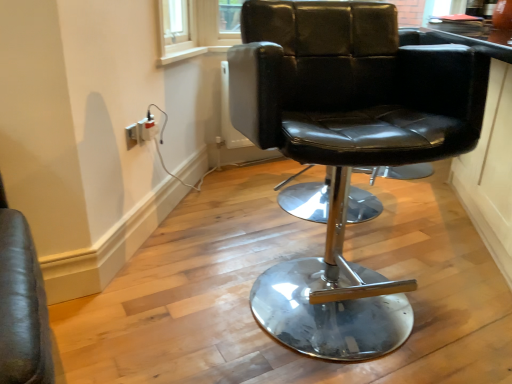
Question: Can you confirm if white plastic electric outlet at lower left, the first electric outlet viewed from the left, is bigger than black leather chair at center?

Choices:
 (A) no
 (B) yes

Answer: (A)

Question: From the image's perspective, is white plastic electric outlet at lower left, the 2th electric outlet viewed from the back, below black leather chair at center?

Choices:
 (A) no
 (B) yes

Answer: (A)

Question: Is white plastic electric outlet at lower left, the 2th electric outlet viewed from the back, positioned before black leather chair at center?

Choices:
 (A) yes
 (B) no

Answer: (B)

Question: Is white plastic electric outlet at lower left, the first electric outlet viewed from the left, facing towards black leather chair at center?

Choices:
 (A) yes
 (B) no

Answer: (A)

Question: Considering the relative sizes of white plastic electric outlet at lower left, the 2th electric outlet viewed from the back, and black leather chair at center in the image provided, is white plastic electric outlet at lower left, the 2th electric outlet viewed from the back, smaller than black leather chair at center?

Choices:
 (A) no
 (B) yes

Answer: (B)

Question: Can you confirm if white plastic electric outlet at lower left, the 2th electric outlet viewed from the back, is thinner than black leather chair at center?

Choices:
 (A) no
 (B) yes

Answer: (B)

Question: Can we say white plastic electric outlet at lower left, the first electric outlet viewed from the left, lies outside white plastic socket at lower left, the 1th electric outlet from the back?

Choices:
 (A) no
 (B) yes

Answer: (B)

Question: From a real-world perspective, is white plastic electric outlet at lower left, the 1th electric outlet from the front, under white plastic socket at lower left, acting as the 2th electric outlet starting from the front?

Choices:
 (A) no
 (B) yes

Answer: (B)

Question: Are white plastic electric outlet at lower left, the 1th electric outlet from the front, and white plastic socket at lower left, the 1th electric outlet in the right-to-left sequence, located far from each other?

Choices:
 (A) no
 (B) yes

Answer: (A)

Question: Considering the relative positions of white plastic electric outlet at lower left, the 1th electric outlet from the front, and white plastic socket at lower left, the 1th electric outlet in the right-to-left sequence, in the image provided, is white plastic electric outlet at lower left, the 1th electric outlet from the front, to the right of white plastic socket at lower left, the 1th electric outlet in the right-to-left sequence, from the viewer's perspective?

Choices:
 (A) no
 (B) yes

Answer: (A)

Question: Considering the relative sizes of white plastic electric outlet at lower left, placed as the 2th electric outlet when sorted from right to left, and white plastic socket at lower left, positioned as the second electric outlet in left-to-right order, in the image provided, is white plastic electric outlet at lower left, placed as the 2th electric outlet when sorted from right to left, smaller than white plastic socket at lower left, positioned as the second electric outlet in left-to-right order,?

Choices:
 (A) yes
 (B) no

Answer: (A)

Question: Is white plastic electric outlet at lower left, the first electric outlet viewed from the left, beside white plastic socket at lower left, acting as the 2th electric outlet starting from the front?

Choices:
 (A) no
 (B) yes

Answer: (B)

Question: Can you confirm if white plastic socket at lower left, positioned as the second electric outlet in left-to-right order, is shorter than white plastic electric outlet at lower left, the 1th electric outlet from the front?

Choices:
 (A) no
 (B) yes

Answer: (B)